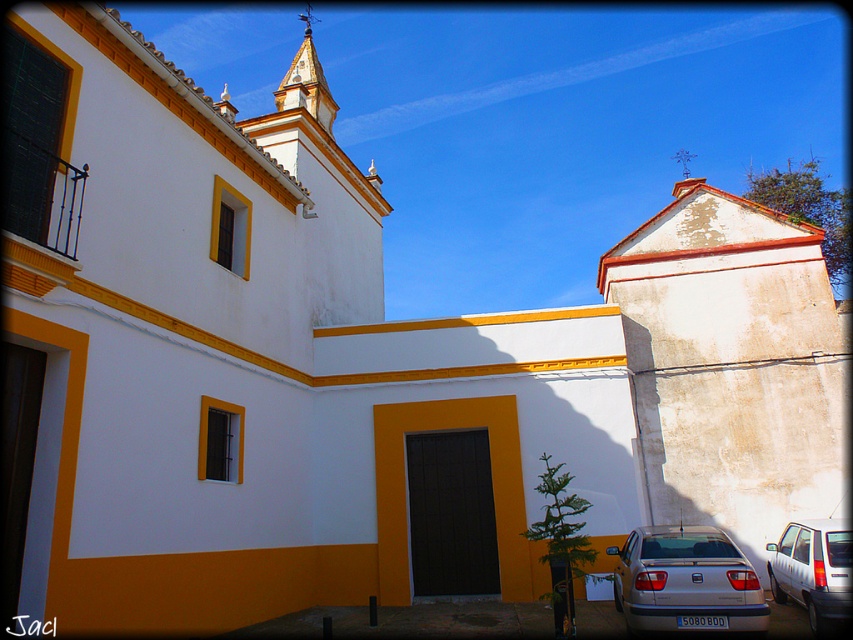
Does silver metallic car at lower right appear over gold textured spire at upper center?

Actually, silver metallic car at lower right is below gold textured spire at upper center.

Is silver metallic car at lower right smaller than gold textured spire at upper center?

Correct, silver metallic car at lower right occupies less space than gold textured spire at upper center.

Between point (647, 556) and point (306, 65), which one is positioned behind?

Point (306, 65)

What are the coordinates of `silver metallic car at lower right` in the screenshot? It's located at (686, 582).

Does white matte car at lower right appear under gold textured spire at upper center?

Yes.

The width and height of the screenshot is (853, 640). Describe the element at coordinates (813, 570) in the screenshot. I see `white matte car at lower right` at that location.

Is point (819, 589) less distant than point (320, 99)?

Yes, it is.

This screenshot has width=853, height=640. In order to click on white matte car at lower right in this screenshot , I will do `click(813, 570)`.

In the scene shown: Who is taller, silver metallic car at lower right or white matte car at lower right?

Standing taller between the two is silver metallic car at lower right.

Is point (735, 564) in front of point (845, 531)?

Yes.

Identify the location of silver metallic car at lower right. This screenshot has height=640, width=853. (686, 582).